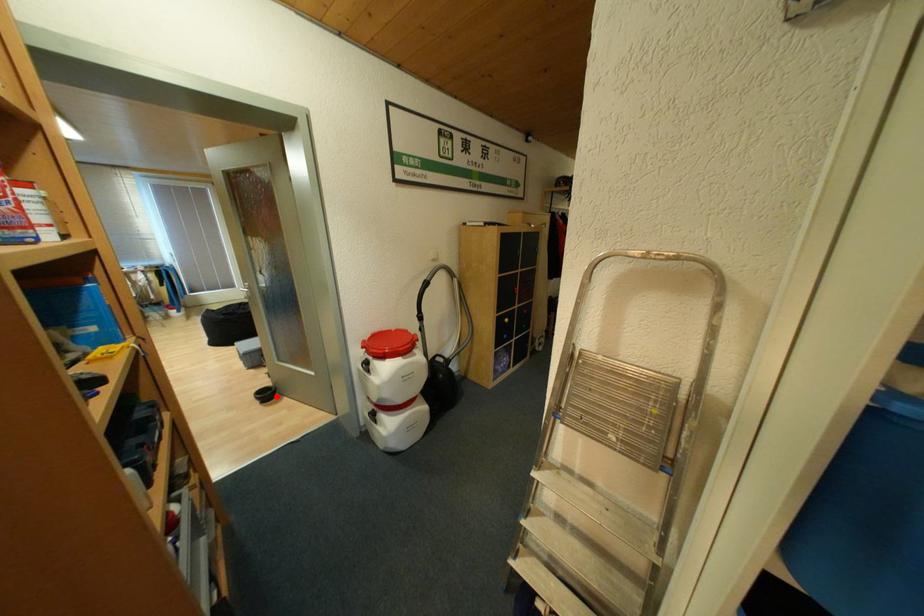
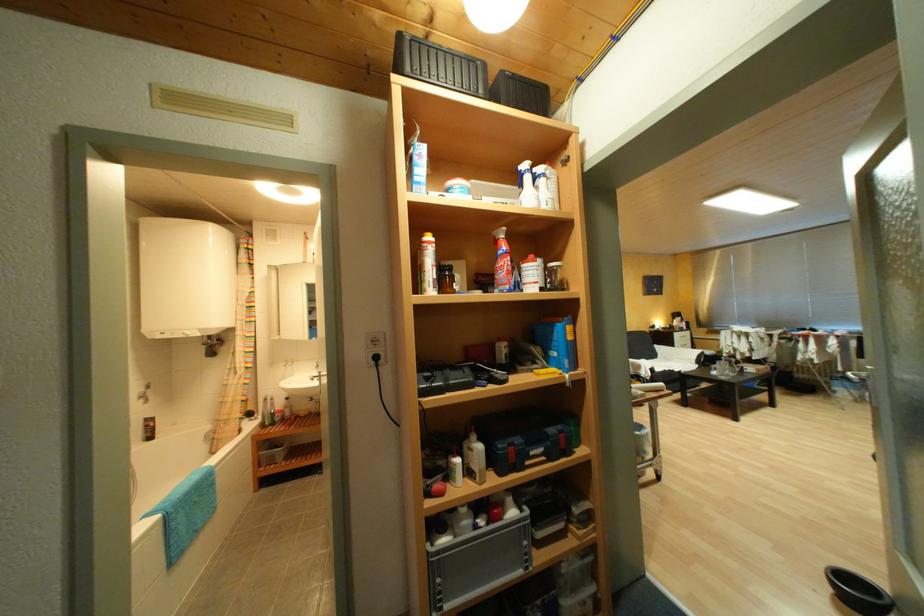
Locate, in the second image, the point that corresponds to the highlighted location in the first image.

(870, 600)